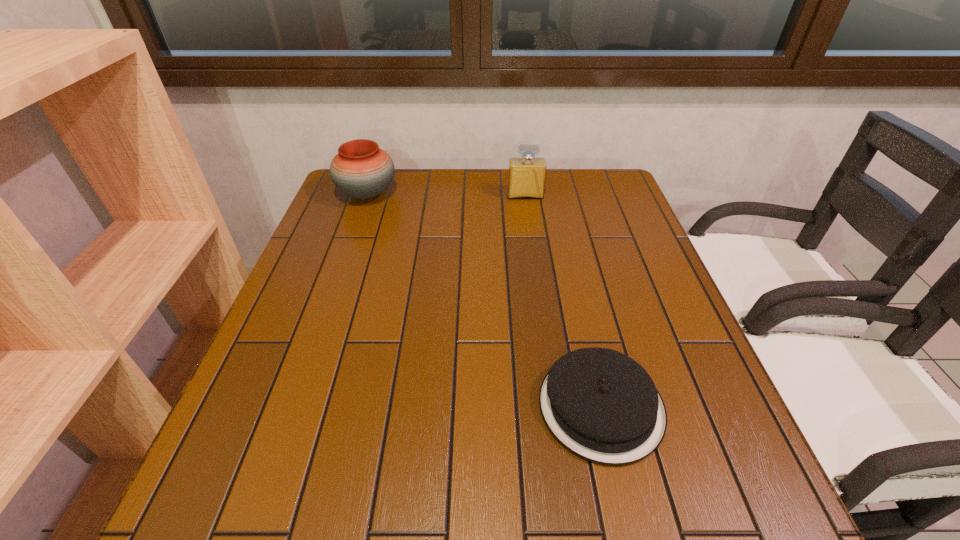
At what (x,y) coordinates should I click in order to perform the action: click on free area in between the shortest object and the perfume. Please return your answer as a coordinate pair (x, y). Looking at the image, I should click on (564, 301).

Where is `vacant area that lies between the pottery and the nearest object`? Image resolution: width=960 pixels, height=540 pixels. vacant area that lies between the pottery and the nearest object is located at coordinates (484, 301).

The image size is (960, 540). What are the coordinates of `unoccupied position between the leftmost object and the perfume` in the screenshot? It's located at (446, 195).

Find the location of a particular element. The image size is (960, 540). empty location between the perfume and the pottery is located at coordinates (446, 195).

You are a GUI agent. You are given a task and a screenshot of the screen. Output one action in this format:
    pyautogui.click(x=<x>, y=<y>)
    Task: Click on the free space that is in between the perfume and the pancake
    This screenshot has width=960, height=540.
    Given the screenshot: What is the action you would take?
    pyautogui.click(x=564, y=301)

At what (x,y) coordinates should I click in order to perform the action: click on free space between the leftmost object and the pancake. Please return your answer as a coordinate pair (x, y). The height and width of the screenshot is (540, 960). Looking at the image, I should click on (484, 301).

In order to click on unoccupied area between the shortest object and the pottery in this screenshot , I will do `click(484, 301)`.

This screenshot has height=540, width=960. Find the location of `object that ranks as the closest to the shortest object`. object that ranks as the closest to the shortest object is located at coordinates (526, 175).

Identify the location of the second closest object to the perfume. This screenshot has width=960, height=540. coord(603,406).

Image resolution: width=960 pixels, height=540 pixels. Identify the location of vacant region that satisfies the following two spatial constraints: 1. on the front-facing side of the nearest object; 2. on the left side of the perfume. (555, 406).